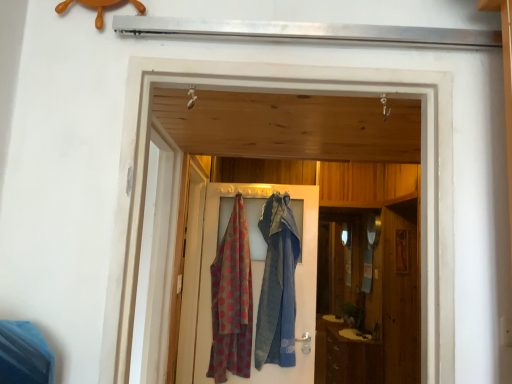
What do you see at coordinates (232, 300) in the screenshot? I see `polka dot fabric at center` at bounding box center [232, 300].

Identify the location of wooden screen door at center, which appears as the second screen door when viewed from the front. Image resolution: width=512 pixels, height=384 pixels. (187, 269).

This screenshot has height=384, width=512. What do you see at coordinates (345, 357) in the screenshot?
I see `brown wood cabinet at lower right` at bounding box center [345, 357].

Image resolution: width=512 pixels, height=384 pixels. What are the coordinates of `polka dot fabric at center` in the screenshot? It's located at (232, 300).

Is wooden screen door at center, which appears as the second screen door when viewed from the front, wider than polka dot fabric at center?

No, wooden screen door at center, which appears as the second screen door when viewed from the front, is not wider than polka dot fabric at center.

Does point (190, 275) appear closer or farther from the camera than point (243, 350)?

Point (190, 275) is farther from the camera than point (243, 350).

Could you tell me if wooden screen door at center, which appears as the second screen door when viewed from the front, is facing polka dot fabric at center?

Yes, wooden screen door at center, which appears as the second screen door when viewed from the front, is aimed at polka dot fabric at center.

From a real-world perspective, who is located higher, wooden screen door at center, the 1th screen door from the back, or polka dot fabric at center?

wooden screen door at center, the 1th screen door from the back, is physically above.

Which object is thinner, white glossy screen door at upper center, positioned as the 1th screen door in front-to-back order, or polka dot fabric at center?

With smaller width is white glossy screen door at upper center, positioned as the 1th screen door in front-to-back order.

Does point (149, 199) come behind point (230, 361)?

No, it is in front of (230, 361).

Measure the distance between white glossy screen door at upper center, which appears as the second screen door when viewed from the back, and polka dot fabric at center.

white glossy screen door at upper center, which appears as the second screen door when viewed from the back, is 30.97 inches away from polka dot fabric at center.

Based on their sizes in the image, would you say white glossy screen door at upper center, positioned as the 1th screen door in front-to-back order, is bigger or smaller than polka dot fabric at center?

In the image, white glossy screen door at upper center, positioned as the 1th screen door in front-to-back order, appears to be smaller than polka dot fabric at center.

Find the location of a particular element. Image resolution: width=512 pixels, height=384 pixels. door that appears above the brown wood cabinet at lower right (from a real-world perspective) is located at coordinates (295, 283).

Considering the sizes of objects brown wood cabinet at lower right and polka dot fabric at center in the image provided, who is wider, brown wood cabinet at lower right or polka dot fabric at center?

With larger width is brown wood cabinet at lower right.

Considering the positions of objects brown wood cabinet at lower right and polka dot fabric at center in the image provided, who is more to the right, brown wood cabinet at lower right or polka dot fabric at center?

From the viewer's perspective, brown wood cabinet at lower right appears more on the right side.

Would you say polka dot fabric at center is part of white glossy screen door at upper center, which appears as the second screen door when viewed from the back,'s contents?

Actually, polka dot fabric at center is outside white glossy screen door at upper center, which appears as the second screen door when viewed from the back.

From a real-world perspective, between white glossy screen door at upper center, which appears as the second screen door when viewed from the back, and polka dot fabric at center, who is vertically lower?

In real-world perspective, polka dot fabric at center is lower.

Is white glossy screen door at upper center, positioned as the 1th screen door in front-to-back order, touching polka dot fabric at center?

No, white glossy screen door at upper center, positioned as the 1th screen door in front-to-back order, is not touching polka dot fabric at center.

Is white glossy screen door at upper center, which appears as the second screen door when viewed from the back, to the left of polka dot fabric at center from the viewer's perspective?

Correct, you'll find white glossy screen door at upper center, which appears as the second screen door when viewed from the back, to the left of polka dot fabric at center.

Does brown wood cabinet at lower right have a lesser height compared to wooden screen door at center, which appears as the second screen door when viewed from the front?

Correct, brown wood cabinet at lower right is not as tall as wooden screen door at center, which appears as the second screen door when viewed from the front.

Can you confirm if brown wood cabinet at lower right is wider than wooden screen door at center, which appears as the second screen door when viewed from the front?

Yes, brown wood cabinet at lower right is wider than wooden screen door at center, which appears as the second screen door when viewed from the front.

Which object is positioned more to the left, brown wood cabinet at lower right or wooden screen door at center, which appears as the second screen door when viewed from the front?

wooden screen door at center, which appears as the second screen door when viewed from the front.

Is wooden screen door at center, which appears as the second screen door when viewed from the front, wider than polka dot fabric at center?

Yes.

Is wooden screen door at center, the 1th screen door from the back, taller or shorter than polka dot fabric at center?

Clearly, wooden screen door at center, the 1th screen door from the back, is taller compared to polka dot fabric at center.

Does wooden screen door at center, which appears as the second screen door when viewed from the front, appear on the right side of polka dot fabric at center?

Incorrect, wooden screen door at center, which appears as the second screen door when viewed from the front, is not on the right side of polka dot fabric at center.

Considering the positions of point (194, 290) and point (301, 195), is point (194, 290) closer or farther from the camera than point (301, 195)?

Point (194, 290).

In the scene shown: Which of these two, polka dot fabric at center or polka dot fabric at center, stands taller?

Standing taller between the two is polka dot fabric at center.

Considering the sizes of objects polka dot fabric at center and polka dot fabric at center in the image provided, who is bigger, polka dot fabric at center or polka dot fabric at center?

polka dot fabric at center is bigger.

Between point (309, 308) and point (230, 230), which one is positioned in front?

Positioned in front is point (309, 308).

Does polka dot fabric at center have a lesser width compared to polka dot fabric at center?

Correct, the width of polka dot fabric at center is less than that of polka dot fabric at center.

Identify the location of the 2nd screen door counting from the left side of the polka dot fabric at center. The width and height of the screenshot is (512, 384). (187, 269).

I want to click on cloth beneath the white glossy screen door at upper center, which appears as the second screen door when viewed from the back (from a real-world perspective), so click(232, 300).

When comparing their distances from white glossy screen door at upper center, which appears as the second screen door when viewed from the back, does brown wood cabinet at lower right or wooden screen door at center, the 1th screen door from the back, seem further?

Among the two, brown wood cabinet at lower right is located further to white glossy screen door at upper center, which appears as the second screen door when viewed from the back.

From the image, which object appears to be farther from polka dot fabric at center, brown wood cabinet at lower right or white glossy screen door at upper center, which appears as the second screen door when viewed from the back?

brown wood cabinet at lower right is positioned further to the anchor polka dot fabric at center.

From the image, which object appears to be nearer to polka dot fabric at center, polka dot fabric at center or brown wood cabinet at lower right?

polka dot fabric at center.

From the image, which object appears to be farther from polka dot fabric at center, brown wood cabinet at lower right or wooden screen door at center, the 1th screen door from the back?

brown wood cabinet at lower right is positioned further to the anchor polka dot fabric at center.

When comparing their distances from wooden screen door at center, the 1th screen door from the back, does brown wood cabinet at lower right or white glossy screen door at upper center, positioned as the 1th screen door in front-to-back order, seem further?

brown wood cabinet at lower right is further to wooden screen door at center, the 1th screen door from the back.

In the scene shown: Estimate the real-world distances between objects in this image. Which object is further from brown wood cabinet at lower right, wooden screen door at center, the 1th screen door from the back, or polka dot fabric at center?

wooden screen door at center, the 1th screen door from the back, is further to brown wood cabinet at lower right.

Which object lies further to the anchor point wooden screen door at center, which appears as the second screen door when viewed from the front, white glossy screen door at upper center, positioned as the 1th screen door in front-to-back order, or polka dot fabric at center?

The object further to wooden screen door at center, which appears as the second screen door when viewed from the front, is white glossy screen door at upper center, positioned as the 1th screen door in front-to-back order.

Considering their positions, is polka dot fabric at center positioned closer to brown wood cabinet at lower right than white glossy screen door at upper center, positioned as the 1th screen door in front-to-back order?

The object closer to brown wood cabinet at lower right is polka dot fabric at center.

Where is `cloth positioned between wooden screen door at center, which appears as the second screen door when viewed from the front, and polka dot fabric at center from near to far`? The height and width of the screenshot is (384, 512). cloth positioned between wooden screen door at center, which appears as the second screen door when viewed from the front, and polka dot fabric at center from near to far is located at coordinates (232, 300).

The width and height of the screenshot is (512, 384). I want to click on screen door between white glossy screen door at upper center, which appears as the second screen door when viewed from the back, and polka dot fabric at center from front to back, so click(187, 269).

Identify the location of cloth between wooden screen door at center, which appears as the second screen door when viewed from the front, and brown wood cabinet at lower right from front to back. The height and width of the screenshot is (384, 512). (232, 300).

Where is `door located between wooden screen door at center, the 1th screen door from the back, and brown wood cabinet at lower right in the depth direction`? door located between wooden screen door at center, the 1th screen door from the back, and brown wood cabinet at lower right in the depth direction is located at coordinates (295, 283).